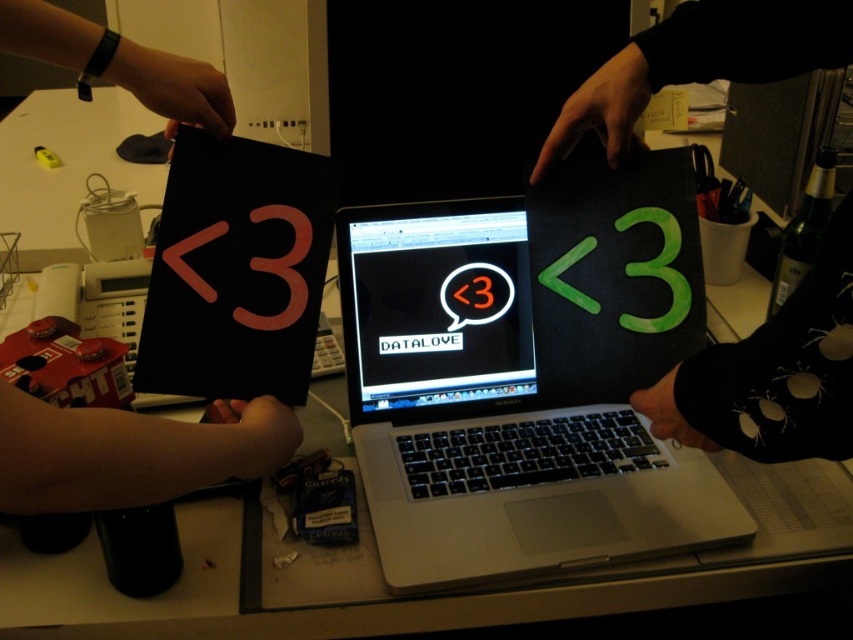
Question: Among these objects, which one is nearest to the camera?

Choices:
 (A) green matte paper at center
 (B) black glossy laptop at center
 (C) black fabric wristband at upper left
 (D) metallic silver laptop at center

Answer: (A)

Question: Is green matte paper at center further to camera compared to black glossy laptop at center?

Choices:
 (A) no
 (B) yes

Answer: (A)

Question: Which point appears closest to the camera in this image?

Choices:
 (A) (370, 243)
 (B) (151, 445)
 (C) (722, 355)

Answer: (B)

Question: Estimate the real-world distances between objects in this image. Which object is closer to the green matte paper at center?

Choices:
 (A) black fabric wristband at upper left
 (B) metallic silver laptop at center
 (C) matte black sign at left

Answer: (B)

Question: Is metallic silver laptop at center to the right of black matte screen at center from the viewer's perspective?

Choices:
 (A) no
 (B) yes

Answer: (B)

Question: Does black glossy laptop at center have a larger size compared to black fabric wristband at upper left?

Choices:
 (A) no
 (B) yes

Answer: (B)